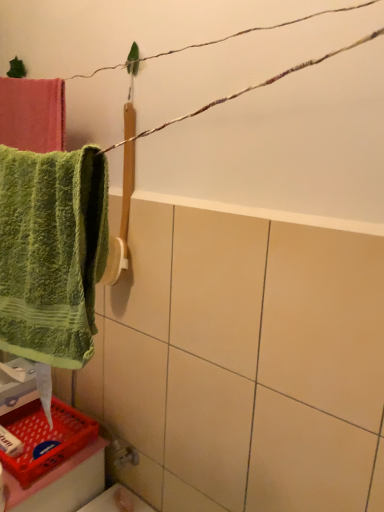
Question: Looking at their shapes, would you say red plastic basket at lower left is wider or thinner than white matte soap at lower left?

Choices:
 (A) thin
 (B) wide

Answer: (B)

Question: In the image, is red plastic basket at lower left positioned in front of or behind white matte soap at lower left?

Choices:
 (A) front
 (B) behind

Answer: (A)

Question: Which object is the farthest from the red plastic basket at lower left?

Choices:
 (A) green textured towel at left
 (B) white matte soap at lower left

Answer: (A)

Question: Considering the real-world distances, which object is farthest from the red plastic basket at lower left?

Choices:
 (A) white matte soap at lower left
 (B) green textured towel at left

Answer: (B)